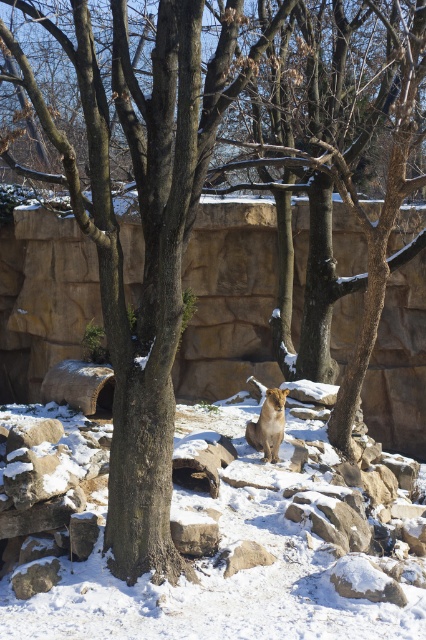
Is point (25, 625) positioned before point (209, 518)?

Yes, it is.

Describe the element at coordinates (198, 556) in the screenshot. I see `white powdery snow at center` at that location.

Where is `white powdery snow at center`? The image size is (426, 640). white powdery snow at center is located at coordinates (198, 556).

Is white powdery snow at center taller than brown rough stone at lower center?

No, white powdery snow at center is not taller than brown rough stone at lower center.

Does white powdery snow at center have a smaller size compared to brown rough stone at lower center?

Indeed, white powdery snow at center has a smaller size compared to brown rough stone at lower center.

Is point (238, 477) positioned in front of point (244, 556)?

No, (238, 477) is further to viewer.

Find the location of a particular element. Image resolution: width=426 pixels, height=640 pixels. white powdery snow at center is located at coordinates (x=198, y=556).

Measure the distance between point (37,531) and camera.

The distance of point (37,531) from camera is 34.17 feet.

Between white powdery snow at center and golden fur lion at center, which one appears on the right side from the viewer's perspective?

Positioned to the right is golden fur lion at center.

Between point (158, 605) and point (252, 435), which one is positioned in front?

Point (158, 605)

Locate an element on the screen. Image resolution: width=426 pixels, height=640 pixels. white powdery snow at center is located at coordinates (198, 556).